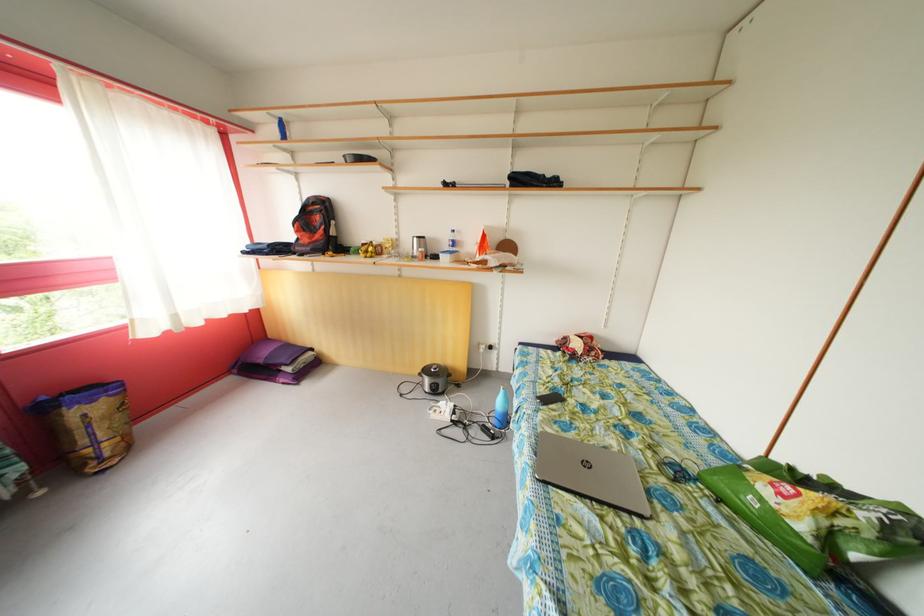
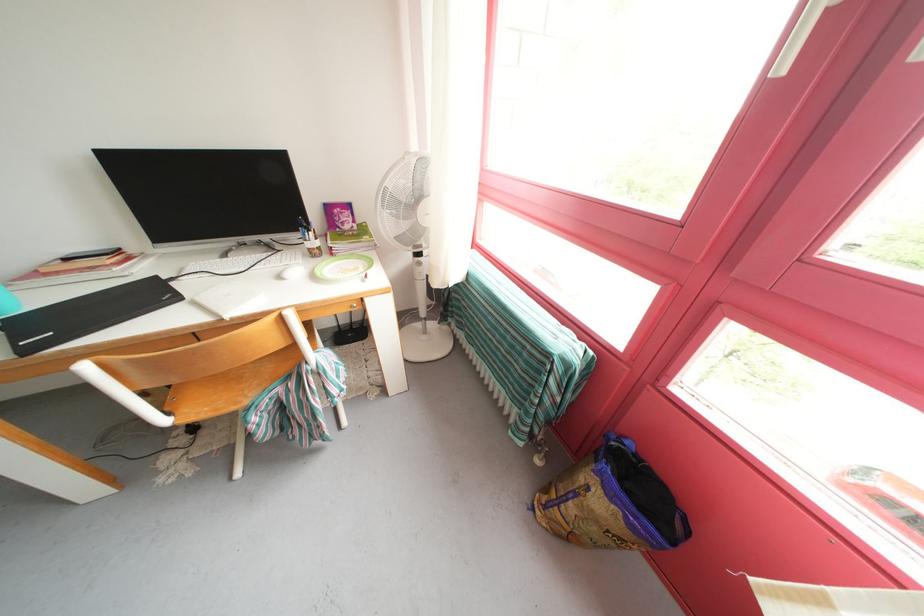
Locate, in the second image, the point that corresponds to point 96,432 in the first image.

(582, 499)